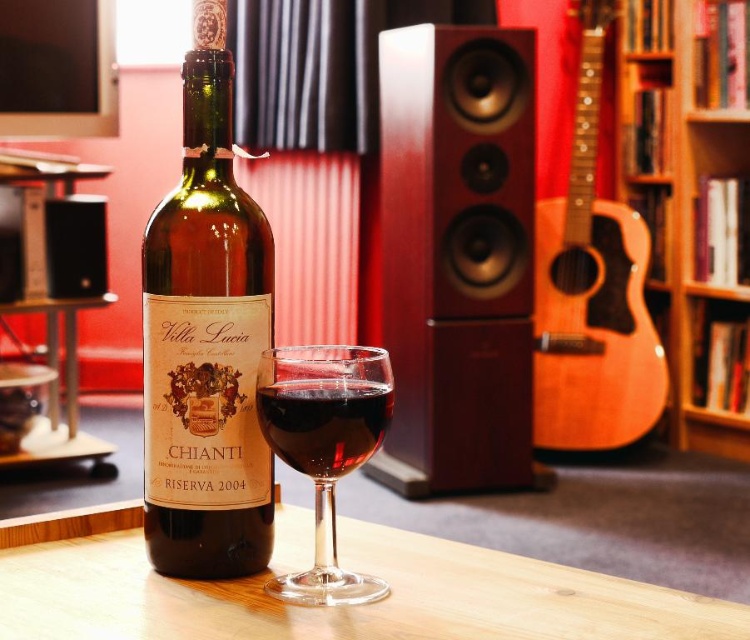
You are holding a small remote control that is 3 inches long. You want to reach the point at coordinates point (204, 253) from your current position. If you can stretch your arm 18 inches forward, will you be able to reach that point?

The distance between point (204, 253) and the camera is 17.60 inches. Since your arm can stretch 18 inches forward, you can reach the point (204, 253).

From the picture: You are a professional photographer setting up a shoot in this room. You need to position a light source so that it illuminates both the natural wood acoustic guitar at center right and the ruby glass at center. Based on their heights, which object should be placed closer to the light source to ensure even lighting?

The natural wood acoustic guitar at center right is taller than the ruby glass at center, so to achieve even lighting, the shorter ruby glass at center should be placed closer to the light source while the taller guitar remains further back.